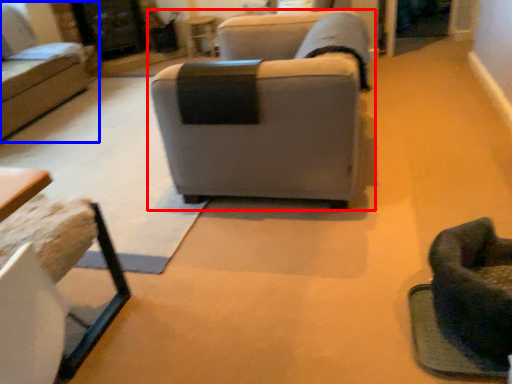
Question: Which of the following is the farthest to the observer, studio couch (highlighted by a red box) or studio couch (highlighted by a blue box)?

Choices:
 (A) studio couch
 (B) studio couch

Answer: (B)